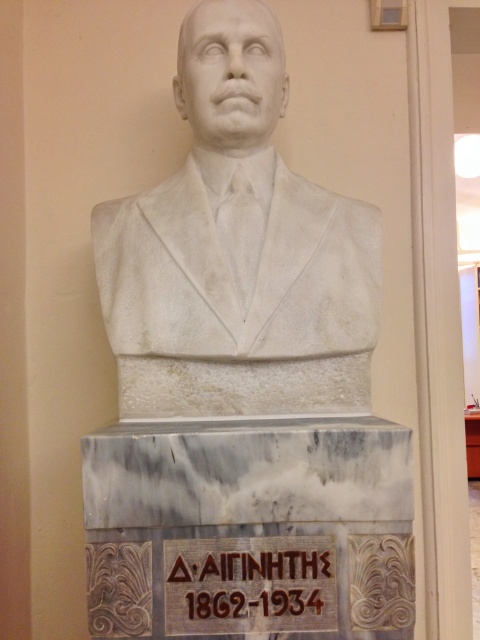
Question: Which point appears farthest from the camera in this image?

Choices:
 (A) (274, 612)
 (B) (379, 257)

Answer: (B)

Question: Which point is closer to the camera?

Choices:
 (A) white marble bust at center
 (B) carved stone plaque at center

Answer: (B)

Question: Where is white marble bust at center located in relation to carved stone plaque at center in the image?

Choices:
 (A) right
 (B) left

Answer: (B)

Question: From the image, what is the correct spatial relationship of white marble bust at center in relation to carved stone plaque at center?

Choices:
 (A) right
 (B) left

Answer: (B)

Question: Which of the following is the farthest from the observer?

Choices:
 (A) (272, 106)
 (B) (202, 586)

Answer: (A)

Question: Is white marble bust at center to the right of carved stone plaque at center from the viewer's perspective?

Choices:
 (A) yes
 (B) no

Answer: (B)